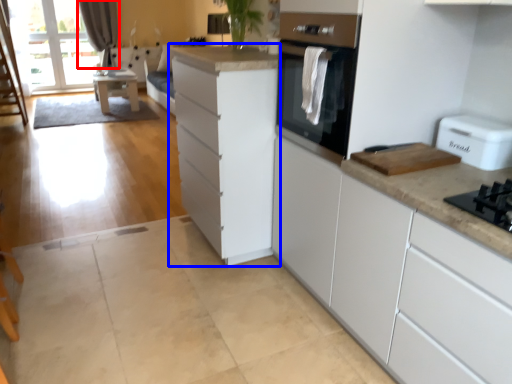
Question: Which of the following is the closest to the observer, curtain (highlighted by a red box) or cabinetry (highlighted by a blue box)?

Choices:
 (A) curtain
 (B) cabinetry

Answer: (B)